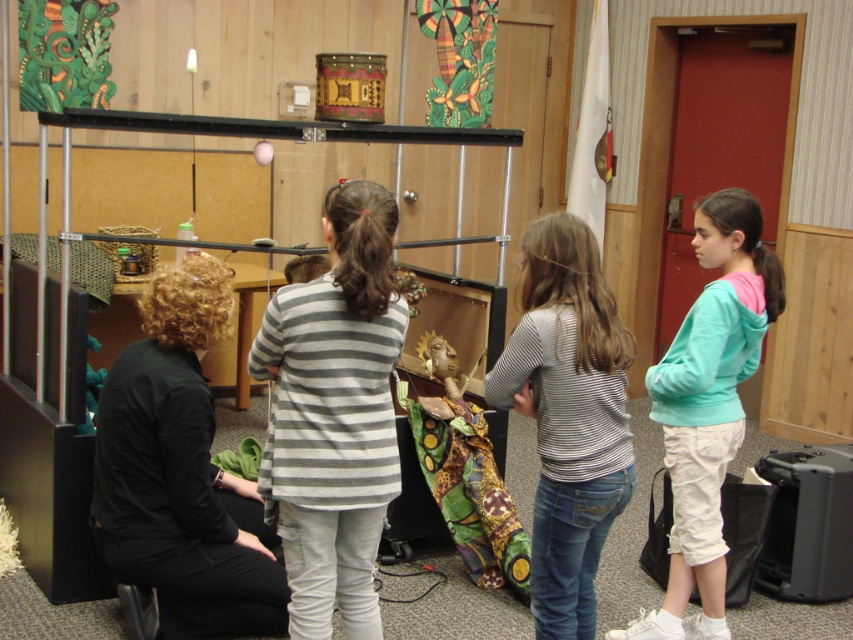
Describe the element at coordinates (708, 406) in the screenshot. I see `teal hoodie at right` at that location.

Who is shorter, teal hoodie at right or matte brown wooden toy at center?

With less height is matte brown wooden toy at center.

The width and height of the screenshot is (853, 640). What do you see at coordinates (708, 406) in the screenshot? I see `teal hoodie at right` at bounding box center [708, 406].

The image size is (853, 640). In order to click on teal hoodie at right in this screenshot , I will do `click(708, 406)`.

Is point (222, 515) closer to viewer compared to point (672, 600)?

That is True.

Which of these two, black matte jacket at lower left or teal hoodie at right, stands taller?

With more height is teal hoodie at right.

Who is more forward, (177, 371) or (709, 360)?

Point (709, 360) is in front.

The width and height of the screenshot is (853, 640). I want to click on black matte jacket at lower left, so click(x=181, y=472).

Can you confirm if striped cotton shirt at center is wider than teal hoodie at right?

Incorrect, striped cotton shirt at center's width does not surpass teal hoodie at right's.

Can you confirm if striped cotton shirt at center is positioned to the right of teal hoodie at right?

Incorrect, striped cotton shirt at center is not on the right side of teal hoodie at right.

This screenshot has height=640, width=853. Describe the element at coordinates (567, 416) in the screenshot. I see `striped cotton shirt at center` at that location.

Image resolution: width=853 pixels, height=640 pixels. Identify the location of striped cotton shirt at center. (567, 416).